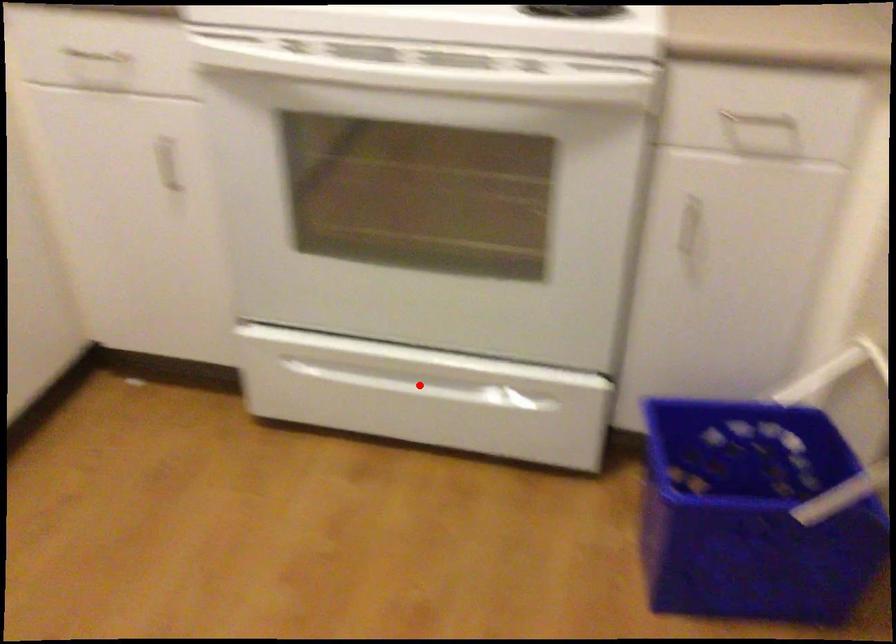
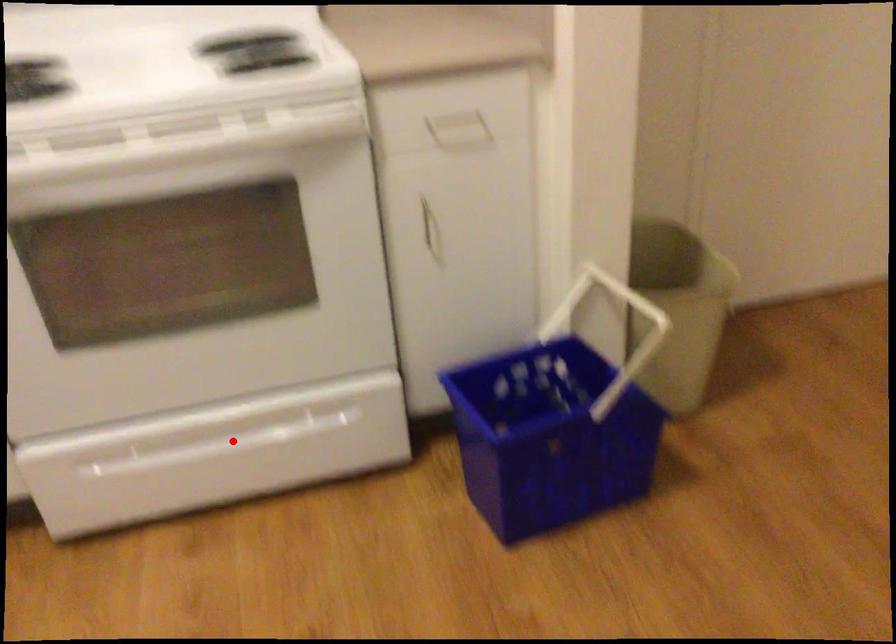
I am providing you with two images of the same scene from different viewpoints. A red point is marked on the first image and another point is marked on the second image. Is the red point in image1 aligned with the point shown in image2?

Yes